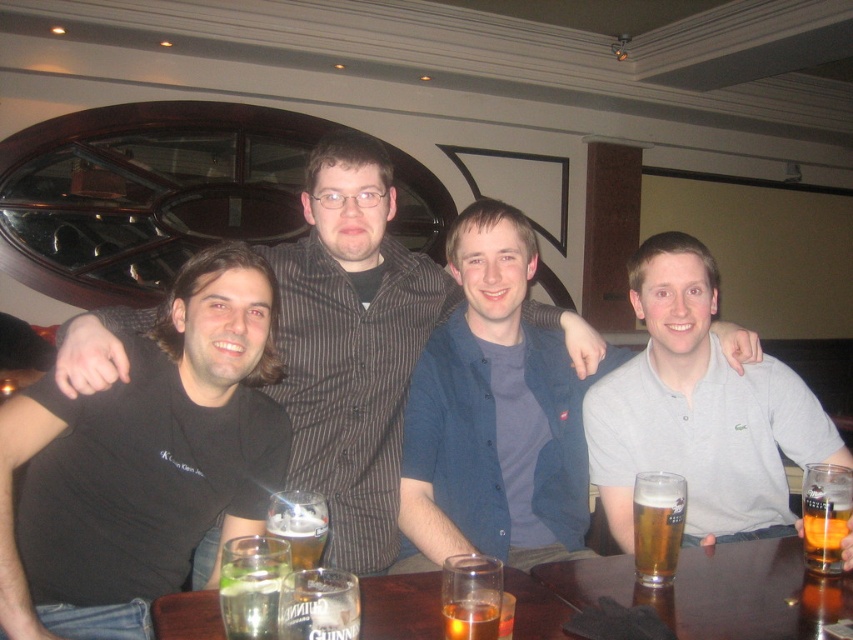
Question: Which point is farther to the camera?

Choices:
 (A) amber glass beer at table right
 (B) black shirt at center
 (C) blue cotton shirt at center
 (D) translucent glass table at center

Answer: (B)

Question: Can you confirm if black t-shirt at center is wider than golden glass beer at center?

Choices:
 (A) yes
 (B) no

Answer: (A)

Question: Is gray polo shirt at center smaller than amber glass beer at table right?

Choices:
 (A) yes
 (B) no

Answer: (B)

Question: Is black shirt at center wider than amber glass beer at table right?

Choices:
 (A) yes
 (B) no

Answer: (A)

Question: Which object is the farthest from the gray polo shirt at center?

Choices:
 (A) blue cotton shirt at center
 (B) translucent glass table at center
 (C) black t-shirt at center

Answer: (C)

Question: Which object is the farthest from the golden glass beer at center?

Choices:
 (A) translucent glass table at center
 (B) blue cotton shirt at center
 (C) gray polo shirt at center

Answer: (B)